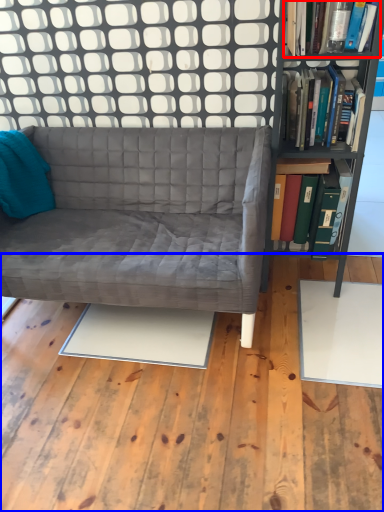
Question: Among these objects, which one is nearest to the camera, book (highlighted by a red box) or plywood (highlighted by a blue box)?

Choices:
 (A) book
 (B) plywood

Answer: (B)